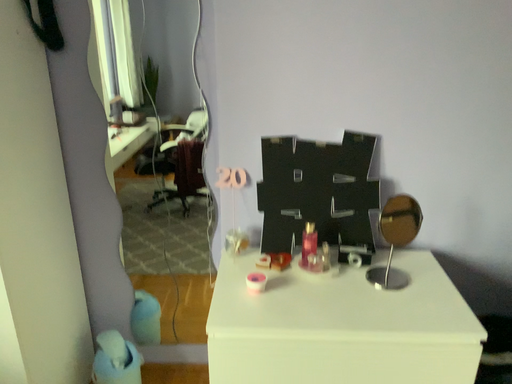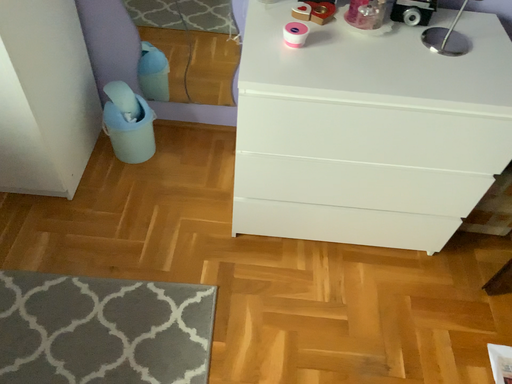
Question: How did the camera likely rotate when shooting the video?

Choices:
 (A) rotated upward
 (B) rotated downward

Answer: (B)